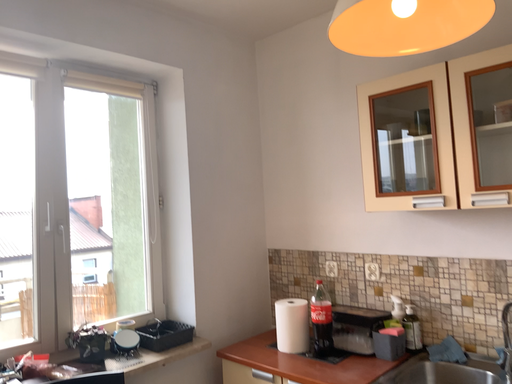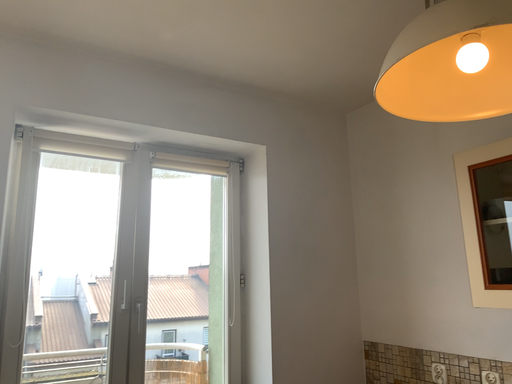
Question: Which way did the camera rotate in the video?

Choices:
 (A) rotated downward
 (B) rotated upward

Answer: (B)